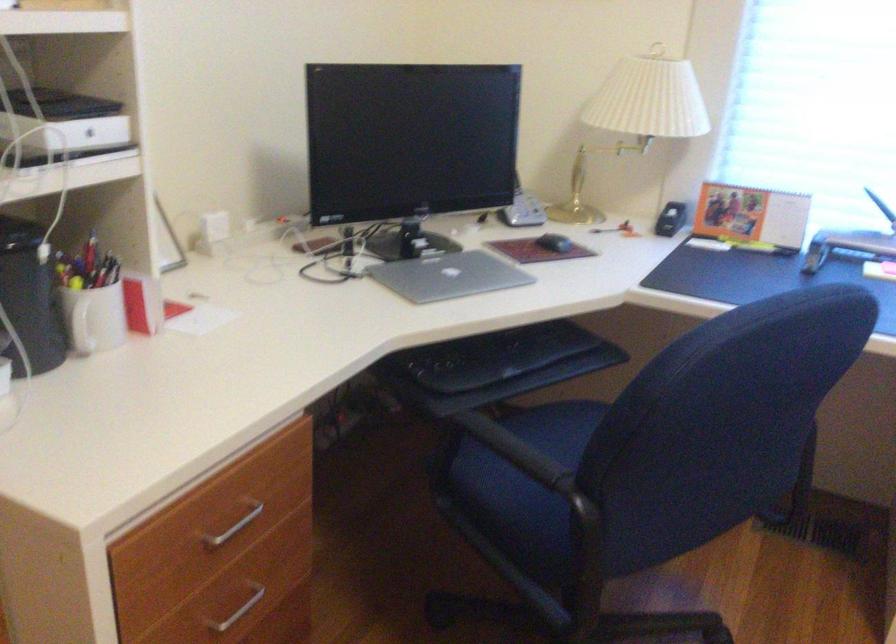
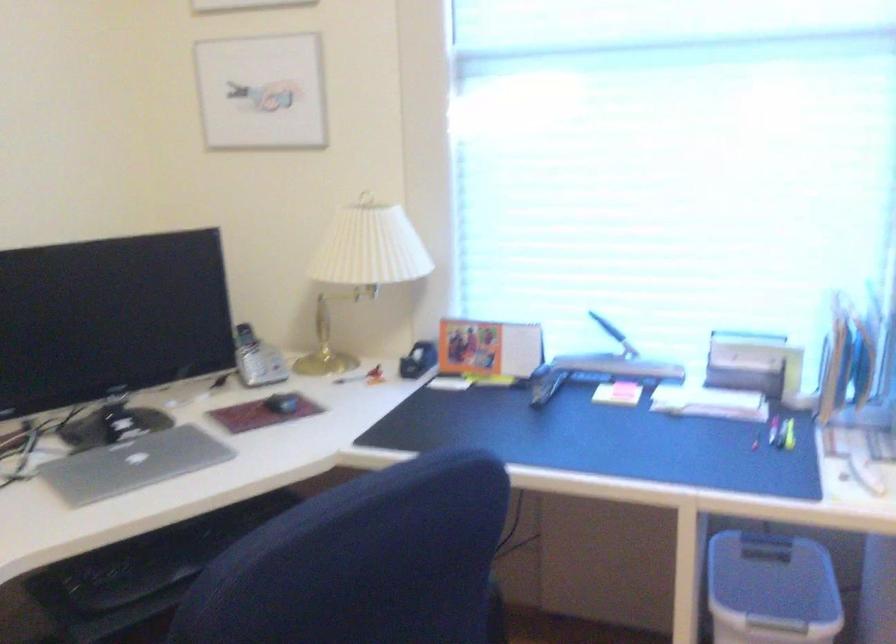
Question: The images are taken continuously from a first-person perspective. In which direction are you moving?

Choices:
 (A) Left
 (B) Right
 (C) Forward
 (D) Backward

Answer: (B)